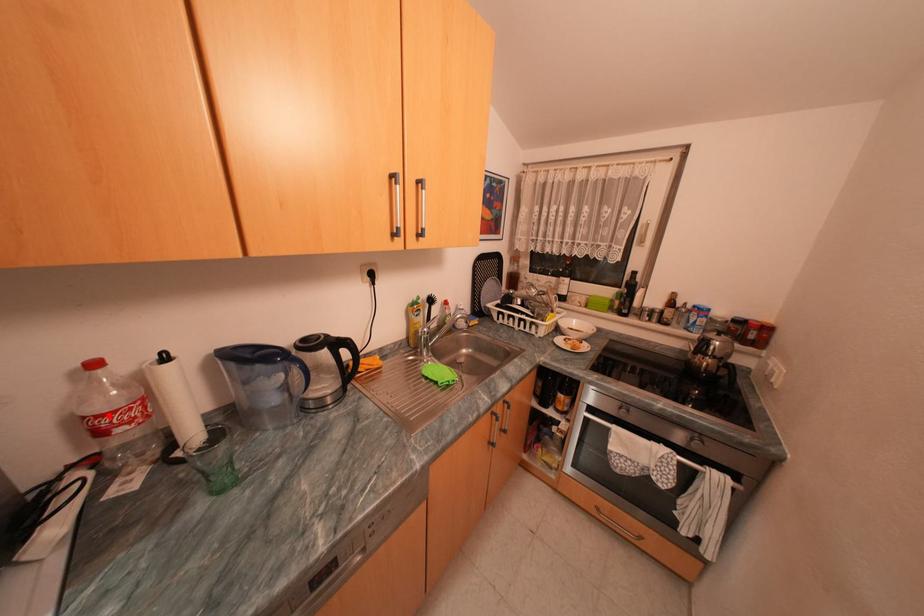
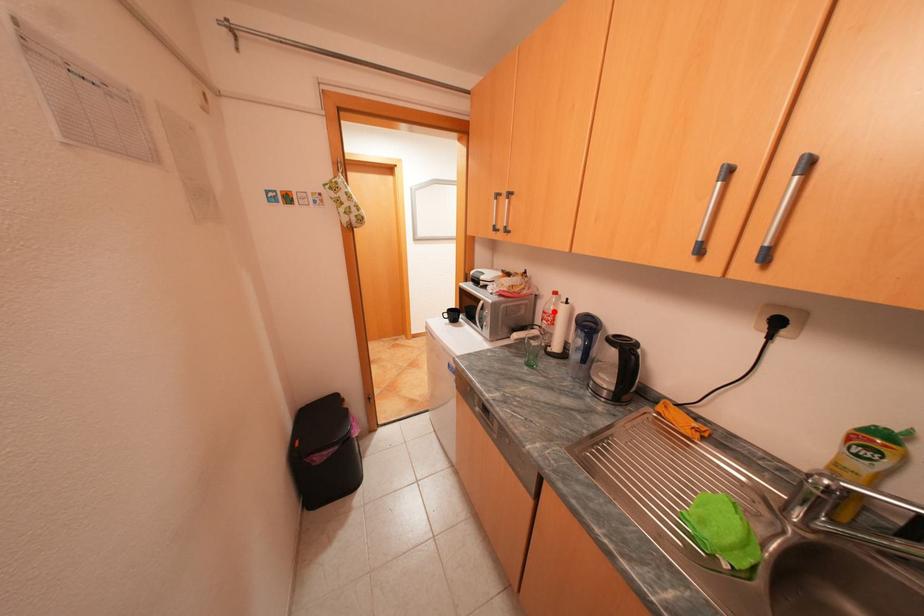
I am providing you with two images of the same scene from different viewpoints. A red point is marked on the first image and another point is marked on the second image. Do the highlighted points in image1 and image2 indicate the same real-world spot?

Yes